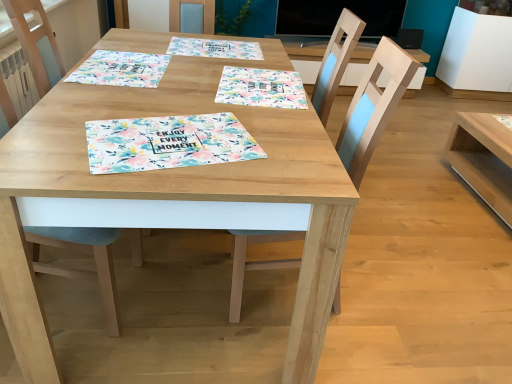
Identify the location of vacant area situated to the left side of floral paper placemat at center. (65, 126).